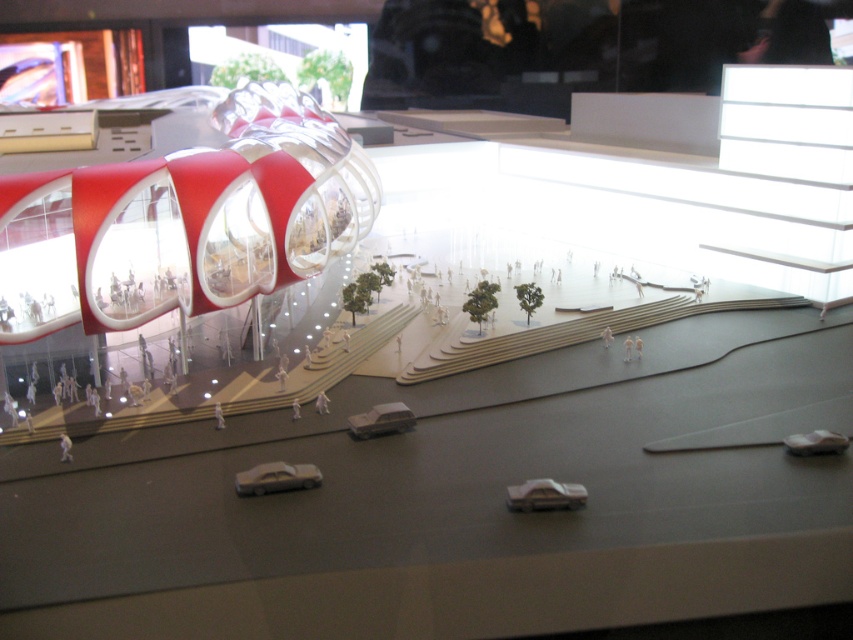
Question: Can you confirm if metallic silver car at center is bigger than white matte toy car at lower right?

Choices:
 (A) no
 (B) yes

Answer: (A)

Question: Which object is the closest to the white matte toy car at lower right?

Choices:
 (A) metallic silver car at center
 (B) white matte toy car at center

Answer: (A)

Question: Observing the image, what is the correct spatial positioning of white glossy toy car at lower center in reference to metallic silver car at center?

Choices:
 (A) below
 (B) above

Answer: (B)

Question: Based on their relative distances, which object is nearer to the white matte toy car at center?

Choices:
 (A) white matte toy car at lower right
 (B) metallic silver car at center

Answer: (B)

Question: Is metallic silver car at center to the left of white matte toy car at lower right from the viewer's perspective?

Choices:
 (A) no
 (B) yes

Answer: (B)

Question: Which object is closer to the camera taking this photo?

Choices:
 (A) white matte toy car at center
 (B) metallic silver car at center
 (C) white matte toy car at lower right
 (D) white glossy toy car at lower center

Answer: (B)